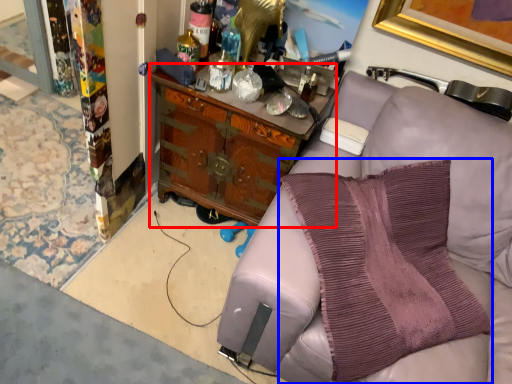
Question: Which object is closer to the camera taking this photo, cabinetry (highlighted by a red box) or pillow (highlighted by a blue box)?

Choices:
 (A) cabinetry
 (B) pillow

Answer: (B)